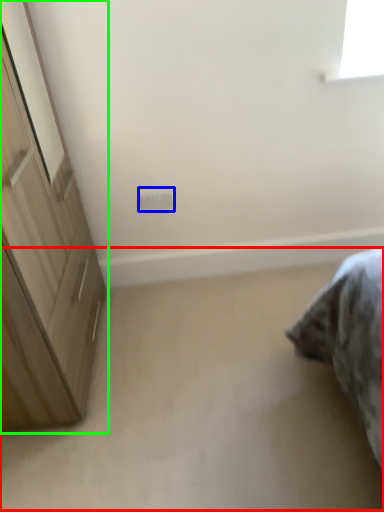
Question: Estimate the real-world distances between objects in this image. Which object is farther from plain (highlighted by a red box), electric outlet (highlighted by a blue box) or cupboard (highlighted by a green box)?

Choices:
 (A) electric outlet
 (B) cupboard

Answer: (A)